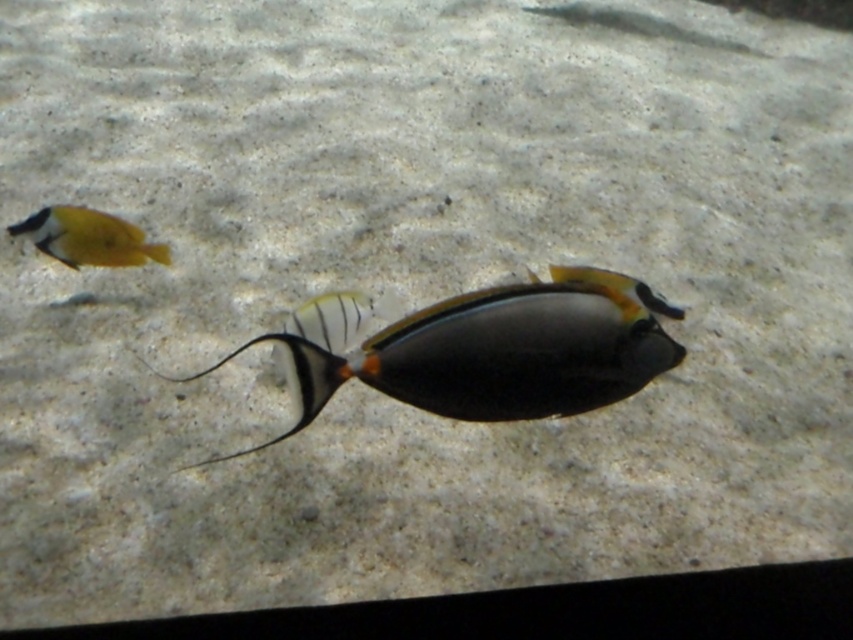
You are a marine biologist observing underwater life. You notice a point marked at coordinates (495,352). Which fish does this point lie on?

The point marked at coordinates (495,352) lies on the shiny black fish at center.

You are a marine biologist observing the underwater scene. You notice the shiny black fish at center and the yellow matte fish at upper left. Which fish is bigger in size?

The shiny black fish at center is larger in size compared to the yellow matte fish at upper left.